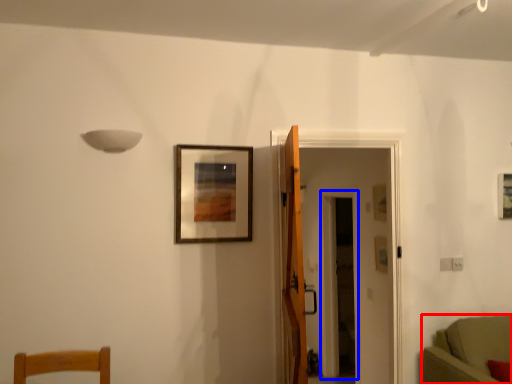
Question: Among these objects, which one is nearest to the camera, furniture (highlighted by a red box) or glass door (highlighted by a blue box)?

Choices:
 (A) furniture
 (B) glass door

Answer: (A)